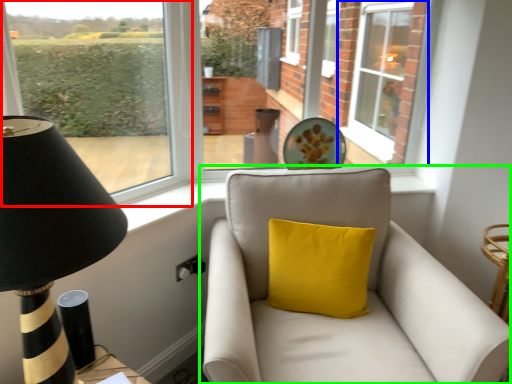
Question: Estimate the real-world distances between objects in this image. Which object is closer to window (highlighted by a red box), window (highlighted by a blue box) or studio couch (highlighted by a green box)?

Choices:
 (A) window
 (B) studio couch

Answer: (B)